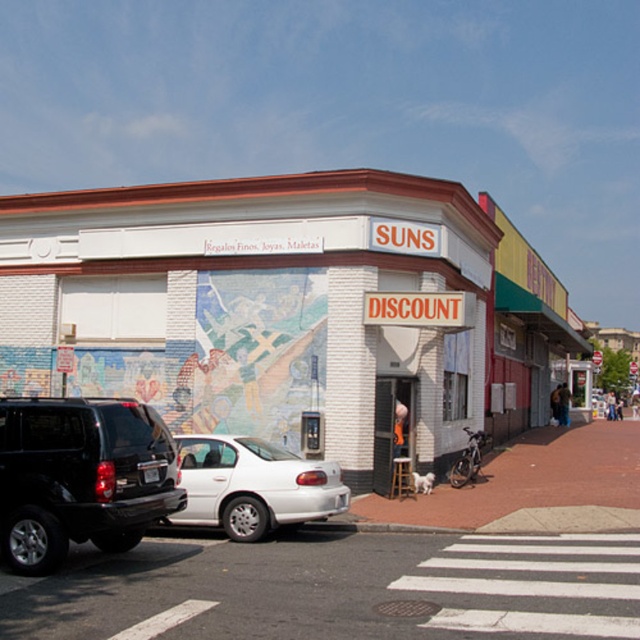
Question: Is white asphalt at lower left wider than black matte suv at left?

Choices:
 (A) no
 (B) yes

Answer: (B)

Question: Which point appears closest to the camera in this image?

Choices:
 (A) (248, 500)
 (B) (140, 241)
 (C) (147, 506)
 (D) (314, 630)

Answer: (D)

Question: Estimate the real-world distances between objects in this image. Which object is farther from the white asphalt at lower left?

Choices:
 (A) white matte sedan at center
 (B) black matte suv at left

Answer: (B)

Question: Is white brick building at center thinner than white asphalt at lower left?

Choices:
 (A) no
 (B) yes

Answer: (A)

Question: Which of these objects is positioned farthest from the white matte sedan at center?

Choices:
 (A) white brick building at center
 (B) black matte suv at left

Answer: (A)

Question: Is black matte suv at left behind white matte sedan at center?

Choices:
 (A) no
 (B) yes

Answer: (A)